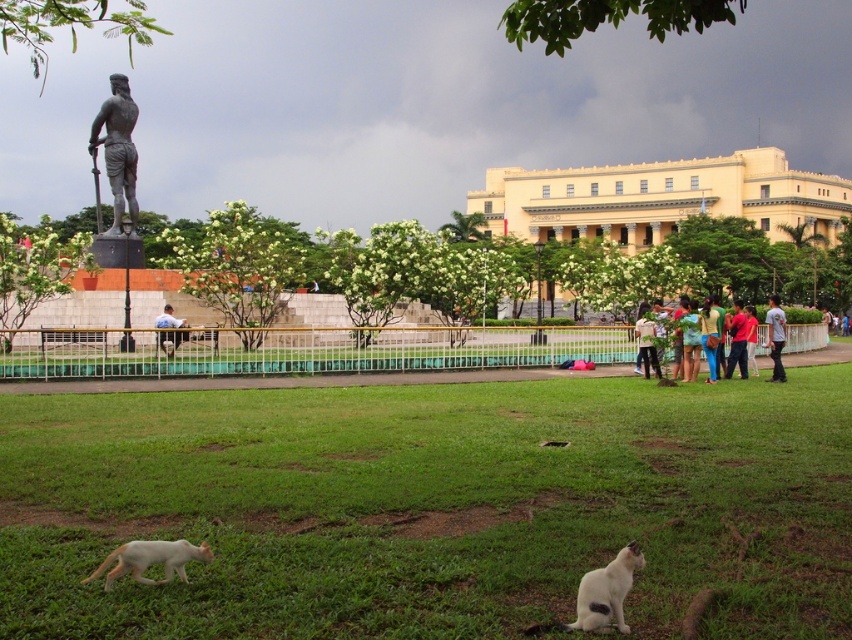
You are a photographer trying to capture two shirts displayed in a park scene. The shirts are the red fabric shirt at center and the light blue shirt at center. From the photographer perspective, which shirt is on the right side?

The red fabric shirt at center is positioned on the right side of light blue shirt at center, so from the photographer perspective, the red fabric shirt at center is on the right side.

You are standing at the center of the park and see two points marked in the image. Which point is closer to you, point (704,317) or point (646,336)?

Point (704,317) is in front of point (646,336), so it is closer to you.

You are a photographer standing in the park and want to take a photo of both the white fur cat at lower right and the white fur cat at lower left. Since you want both cats to be in focus, you need to know which cat is closer to you. Can you determine which cat is closer based on their sizes?

The white fur cat at lower right is much taller than the white fur cat at lower left, which indicates that the white fur cat at lower right is closer to you.